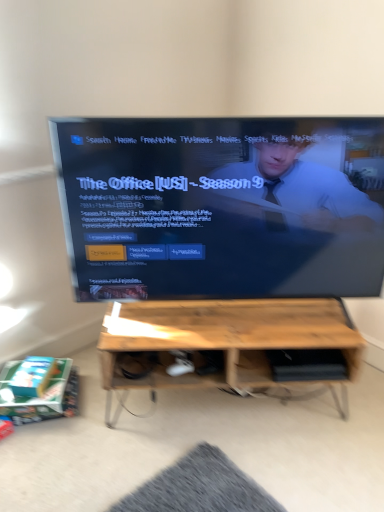
Question: Does wooden table at center lie behind matte black tv at center?

Choices:
 (A) yes
 (B) no

Answer: (A)

Question: From the image's perspective, is wooden table at center below matte black tv at center?

Choices:
 (A) no
 (B) yes

Answer: (B)

Question: Does wooden table at center have a greater width compared to matte black tv at center?

Choices:
 (A) no
 (B) yes

Answer: (B)

Question: From the image's perspective, is wooden table at center above matte black tv at center?

Choices:
 (A) yes
 (B) no

Answer: (B)

Question: Is wooden table at center facing away from matte black tv at center?

Choices:
 (A) no
 (B) yes

Answer: (A)

Question: Does wooden table at center have a greater height compared to matte black tv at center?

Choices:
 (A) yes
 (B) no

Answer: (B)

Question: Does matte black tv at center have a smaller size compared to wooden table at center?

Choices:
 (A) no
 (B) yes

Answer: (A)

Question: Is wooden table at center a part of matte black tv at center?

Choices:
 (A) yes
 (B) no

Answer: (B)

Question: From a real-world perspective, is matte black tv at center located higher than wooden table at center?

Choices:
 (A) yes
 (B) no

Answer: (A)

Question: From a real-world perspective, is matte black tv at center under wooden table at center?

Choices:
 (A) no
 (B) yes

Answer: (A)

Question: Is matte black tv at center facing towards wooden table at center?

Choices:
 (A) yes
 (B) no

Answer: (B)

Question: Can you confirm if matte black tv at center is taller than wooden table at center?

Choices:
 (A) yes
 (B) no

Answer: (A)

Question: Looking at the image, does matte black tv at center seem bigger or smaller compared to wooden table at center?

Choices:
 (A) small
 (B) big

Answer: (B)